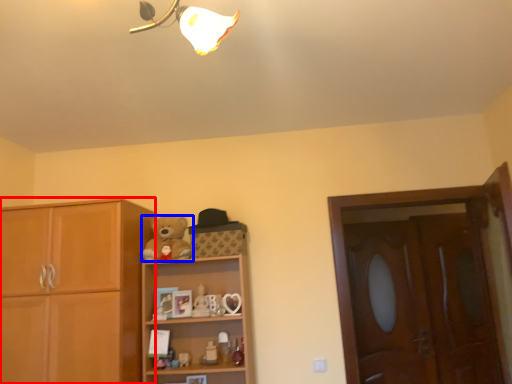
Question: Which of the following is the farthest to the observer, cabinetry (highlighted by a red box) or teddy bear (highlighted by a blue box)?

Choices:
 (A) cabinetry
 (B) teddy bear

Answer: (B)